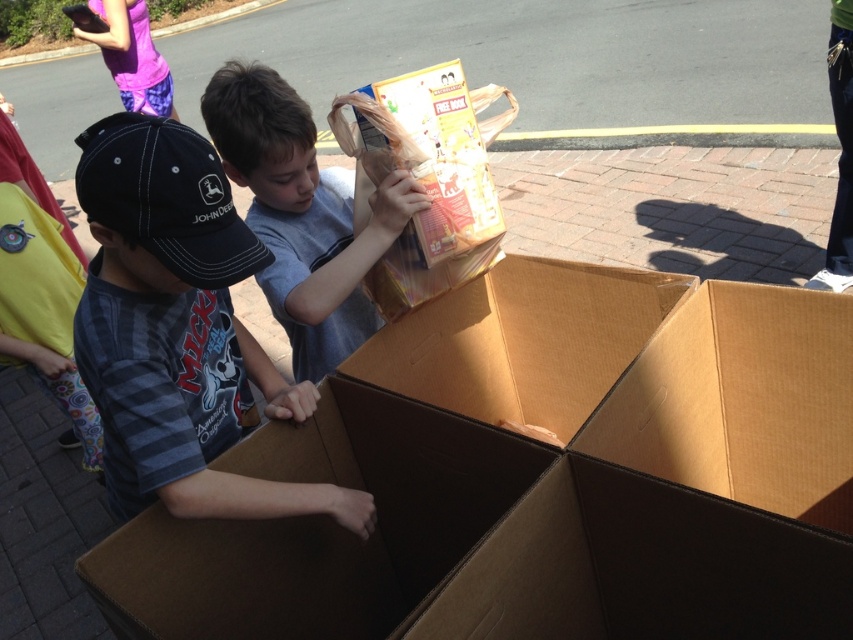
Question: Which object appears farthest from the camera in this image?

Choices:
 (A) striped cotton shirt at center
 (B) brown cardboard box at center
 (C) matte cardboard box at center
 (D) matte gray shirt at center

Answer: (D)

Question: Which point is farther from the camera taking this photo?

Choices:
 (A) (426, 214)
 (B) (135, 212)

Answer: (A)

Question: Considering the relative positions of brown cardboard box at center and matte cardboard box at center in the image provided, where is brown cardboard box at center located with respect to matte cardboard box at center?

Choices:
 (A) above
 (B) below

Answer: (B)

Question: Which of the following is the closest to the observer?

Choices:
 (A) matte gray shirt at center
 (B) brown cardboard box at center
 (C) striped cotton shirt at center

Answer: (B)

Question: Can you confirm if brown cardboard box at center is positioned below matte cardboard box at center?

Choices:
 (A) yes
 (B) no

Answer: (A)

Question: Can you confirm if matte gray shirt at center is positioned above matte cardboard box at center?

Choices:
 (A) yes
 (B) no

Answer: (B)